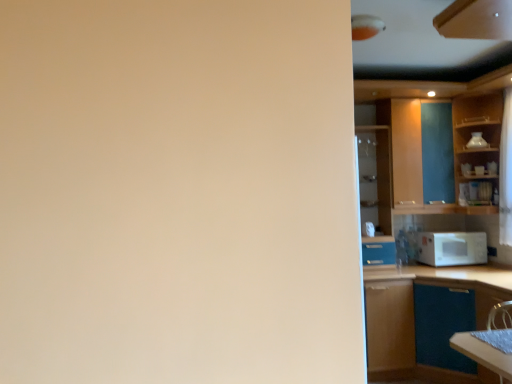
Measure the distance between matte glass cabinet at right, arranged as the first cabinetry when viewed from the back, and camera.

matte glass cabinet at right, arranged as the first cabinetry when viewed from the back, and camera are 12.53 feet apart.

What do you see at coordinates (389, 325) in the screenshot? I see `brown matte cabinet at right, placed as the third cabinetry when sorted from back to front` at bounding box center [389, 325].

This screenshot has width=512, height=384. Find the location of `white matte microwave at right`. white matte microwave at right is located at coordinates (451, 248).

How much space does wooden cabinet at upper right, which is the first cabinetry from front to back, occupy horizontally?

wooden cabinet at upper right, which is the first cabinetry from front to back, is 19.84 inches in width.

Where is `matte glass cabinet at right, arranged as the 5th cabinetry when viewed from the front`? matte glass cabinet at right, arranged as the 5th cabinetry when viewed from the front is located at coordinates (375, 177).

Considering the relative sizes of matte glass cabinet at right, arranged as the 5th cabinetry when viewed from the front, and brown matte cabinet at right, placed as the third cabinetry when sorted from back to front, in the image provided, is matte glass cabinet at right, arranged as the 5th cabinetry when viewed from the front, shorter than brown matte cabinet at right, placed as the third cabinetry when sorted from back to front,?

Incorrect, the height of matte glass cabinet at right, arranged as the 5th cabinetry when viewed from the front, does not fall short of that of brown matte cabinet at right, placed as the third cabinetry when sorted from back to front.

In the image, is matte glass cabinet at right, arranged as the 5th cabinetry when viewed from the front, positioned in front of or behind brown matte cabinet at right, placed as the third cabinetry when sorted from back to front?

In the image, matte glass cabinet at right, arranged as the 5th cabinetry when viewed from the front, appears behind brown matte cabinet at right, placed as the third cabinetry when sorted from back to front.

Is matte glass cabinet at right, arranged as the first cabinetry when viewed from the back, not inside brown matte cabinet at right, the 3th cabinetry positioned from the front?

Yes.

Which is more to the right, matte glass cabinet at right, arranged as the first cabinetry when viewed from the back, or brown matte cabinet at right, placed as the third cabinetry when sorted from back to front?

From the viewer's perspective, brown matte cabinet at right, placed as the third cabinetry when sorted from back to front, appears more on the right side.

Who is taller, white matte microwave at right or white sheer curtain at right?

white sheer curtain at right.

Are white matte microwave at right and white sheer curtain at right far apart?

No, white matte microwave at right is not far away from white sheer curtain at right.

Is white matte microwave at right facing towards white sheer curtain at right?

No, white matte microwave at right is not oriented towards white sheer curtain at right.

Locate an element on the screen. Image resolution: width=512 pixels, height=384 pixels. curtain above the white matte microwave at right (from the image's perspective) is located at coordinates (506, 172).

Is white matte microwave at right completely or partially inside wooden cabinet at upper right, marked as the 5th cabinetry in a back-to-front arrangement?

No, wooden cabinet at upper right, marked as the 5th cabinetry in a back-to-front arrangement, does not contain white matte microwave at right.

Find the location of a particular element. The image size is (512, 384). microwave oven behind the wooden cabinet at upper right, marked as the 5th cabinetry in a back-to-front arrangement is located at coordinates (451, 248).

Between wooden cabinet at upper right, marked as the 5th cabinetry in a back-to-front arrangement, and white matte microwave at right, which one has more height?

With more height is white matte microwave at right.

Does white sheer curtain at right have a smaller size compared to matte glass cabinet at right, arranged as the 5th cabinetry when viewed from the front?

Indeed, white sheer curtain at right has a smaller size compared to matte glass cabinet at right, arranged as the 5th cabinetry when viewed from the front.

Which object is closer to the camera, white sheer curtain at right or matte glass cabinet at right, arranged as the first cabinetry when viewed from the back?

white sheer curtain at right.

Which is further, (x=509, y=172) or (x=384, y=153)?

The point (x=384, y=153) is more distant.

From a real-world perspective, is white sheer curtain at right on top of matte glass cabinet at right, arranged as the 5th cabinetry when viewed from the front?

Yes.

Would you say wooden cabinet at upper right, which is the first cabinetry from front to back, is to the left or to the right of white sheer curtain at right in the picture?

wooden cabinet at upper right, which is the first cabinetry from front to back, is to the left of white sheer curtain at right.

How much distance is there between wooden cabinet at upper right, which is the first cabinetry from front to back, and white sheer curtain at right?

5.62 feet.

Between wooden cabinet at upper right, marked as the 5th cabinetry in a back-to-front arrangement, and white sheer curtain at right, which one has more height?

white sheer curtain at right is taller.

Is wooden cabinet at upper right, which is the first cabinetry from front to back, spatially inside white sheer curtain at right, or outside of it?

wooden cabinet at upper right, which is the first cabinetry from front to back, is located beyond the bounds of white sheer curtain at right.

Looking at this image, would you say wooden cabinet at right, which appears as the second cabinetry when viewed from the back, is a long distance from matte glass cabinet at right, arranged as the 5th cabinetry when viewed from the front?

No, wooden cabinet at right, which appears as the second cabinetry when viewed from the back, is not far away from matte glass cabinet at right, arranged as the 5th cabinetry when viewed from the front.

Is wooden cabinet at right, which appears as the second cabinetry when viewed from the back, smaller than matte glass cabinet at right, arranged as the first cabinetry when viewed from the back?

Yes.

Considering the sizes of objects wooden cabinet at right, marked as the fourth cabinetry in a front-to-back arrangement, and matte glass cabinet at right, arranged as the 5th cabinetry when viewed from the front, in the image provided, who is taller, wooden cabinet at right, marked as the fourth cabinetry in a front-to-back arrangement, or matte glass cabinet at right, arranged as the 5th cabinetry when viewed from the front,?

matte glass cabinet at right, arranged as the 5th cabinetry when viewed from the front.

Could you measure the distance between wooden cabinet at right, which appears as the second cabinetry when viewed from the back, and matte glass cabinet at right, arranged as the first cabinetry when viewed from the back?

wooden cabinet at right, which appears as the second cabinetry when viewed from the back, is 28.85 inches from matte glass cabinet at right, arranged as the first cabinetry when viewed from the back.

Between brown matte cabinet at right, placed as the third cabinetry when sorted from back to front, and wooden cabinet at upper right, marked as the 5th cabinetry in a back-to-front arrangement, which one has smaller size?

wooden cabinet at upper right, marked as the 5th cabinetry in a back-to-front arrangement, is smaller.

Which is more to the left, brown matte cabinet at right, the 3th cabinetry positioned from the front, or wooden cabinet at upper right, marked as the 5th cabinetry in a back-to-front arrangement?

From the viewer's perspective, brown matte cabinet at right, the 3th cabinetry positioned from the front, appears more on the left side.

Is brown matte cabinet at right, the 3th cabinetry positioned from the front, far from wooden cabinet at upper right, which is the first cabinetry from front to back?

Indeed, brown matte cabinet at right, the 3th cabinetry positioned from the front, is not near wooden cabinet at upper right, which is the first cabinetry from front to back.

Where is `the 4th cabinetry directly beneath the wooden cabinet at upper right, marked as the 5th cabinetry in a back-to-front arrangement (from a real-world perspective)`? the 4th cabinetry directly beneath the wooden cabinet at upper right, marked as the 5th cabinetry in a back-to-front arrangement (from a real-world perspective) is located at coordinates (389, 325).

Where is `cabinetry lying on the left of brown matte cabinet at right, placed as the third cabinetry when sorted from back to front`? The width and height of the screenshot is (512, 384). cabinetry lying on the left of brown matte cabinet at right, placed as the third cabinetry when sorted from back to front is located at coordinates (375, 177).

Identify the location of microwave oven directly beneath the white sheer curtain at right (from a real-world perspective). Image resolution: width=512 pixels, height=384 pixels. (451, 248).

When comparing their distances from white matte cabinet at right, which ranks as the 4th cabinetry in back-to-front order, does matte glass cabinet at right, arranged as the first cabinetry when viewed from the back, or white matte microwave at right seem closer?

white matte microwave at right lies closer to white matte cabinet at right, which ranks as the 4th cabinetry in back-to-front order, than the other object.

When comparing their distances from matte glass cabinet at right, arranged as the first cabinetry when viewed from the back, does brown matte cabinet at right, placed as the third cabinetry when sorted from back to front, or white sheer curtain at right seem closer?

brown matte cabinet at right, placed as the third cabinetry when sorted from back to front, lies closer to matte glass cabinet at right, arranged as the first cabinetry when viewed from the back, than the other object.

When comparing their distances from matte glass cabinet at right, arranged as the 5th cabinetry when viewed from the front, does wooden cabinet at right, which appears as the second cabinetry when viewed from the back, or wooden cabinet at upper right, marked as the 5th cabinetry in a back-to-front arrangement, seem closer?

wooden cabinet at right, which appears as the second cabinetry when viewed from the back, lies closer to matte glass cabinet at right, arranged as the 5th cabinetry when viewed from the front, than the other object.

Considering their positions, is white matte microwave at right positioned further to matte glass cabinet at right, arranged as the first cabinetry when viewed from the back, than wooden cabinet at right, marked as the fourth cabinetry in a front-to-back arrangement?

Based on the image, wooden cabinet at right, marked as the fourth cabinetry in a front-to-back arrangement, appears to be further to matte glass cabinet at right, arranged as the first cabinetry when viewed from the back.

When comparing their distances from white matte microwave at right, does brown matte cabinet at right, placed as the third cabinetry when sorted from back to front, or matte glass cabinet at right, arranged as the first cabinetry when viewed from the back, seem further?

brown matte cabinet at right, placed as the third cabinetry when sorted from back to front.

When comparing their distances from white sheer curtain at right, does wooden cabinet at upper right, which is the first cabinetry from front to back, or white matte microwave at right seem closer?

white matte microwave at right is positioned closer to the anchor white sheer curtain at right.

Considering their positions, is white matte cabinet at right, the 2th cabinetry when ordered from front to back, positioned closer to matte glass cabinet at right, arranged as the 5th cabinetry when viewed from the front, than white matte microwave at right?

Among the two, white matte microwave at right is located nearer to matte glass cabinet at right, arranged as the 5th cabinetry when viewed from the front.

Considering their positions, is white sheer curtain at right positioned closer to white matte cabinet at right, the 2th cabinetry when ordered from front to back, than white matte microwave at right?

white matte microwave at right lies closer to white matte cabinet at right, the 2th cabinetry when ordered from front to back, than the other object.

The image size is (512, 384). Find the location of `curtain between wooden cabinet at upper right, which is the first cabinetry from front to back, and brown matte cabinet at right, placed as the third cabinetry when sorted from back to front, in the vertical direction`. curtain between wooden cabinet at upper right, which is the first cabinetry from front to back, and brown matte cabinet at right, placed as the third cabinetry when sorted from back to front, in the vertical direction is located at coordinates (506, 172).

The height and width of the screenshot is (384, 512). Find the location of `microwave oven located between matte glass cabinet at right, arranged as the first cabinetry when viewed from the back, and wooden cabinet at right, which appears as the second cabinetry when viewed from the back, in the left-right direction`. microwave oven located between matte glass cabinet at right, arranged as the first cabinetry when viewed from the back, and wooden cabinet at right, which appears as the second cabinetry when viewed from the back, in the left-right direction is located at coordinates (451, 248).

Find the location of a particular element. The height and width of the screenshot is (384, 512). microwave oven between white sheer curtain at right and white matte cabinet at right, which ranks as the 4th cabinetry in back-to-front order, vertically is located at coordinates (451, 248).

At what (x,y) coordinates should I click in order to perform the action: click on cabinetry that lies between wooden cabinet at right, which appears as the second cabinetry when viewed from the back, and white matte cabinet at right, the 2th cabinetry when ordered from front to back, from top to bottom. Please return your answer as a coordinate pair (x, y). Image resolution: width=512 pixels, height=384 pixels. Looking at the image, I should click on (375, 177).